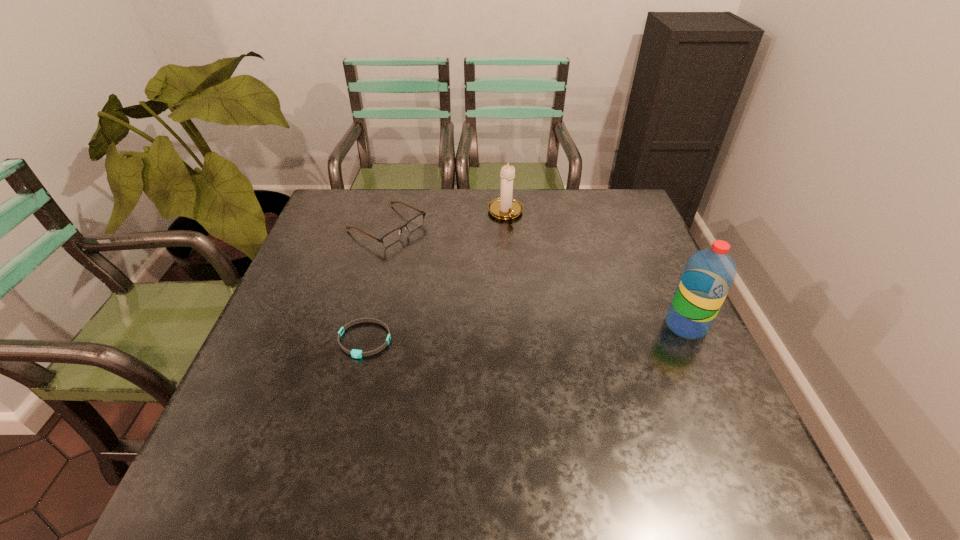
This screenshot has height=540, width=960. I want to click on vacant spot on the desktop that is between the shortest object and the tallest object and is positioned on the front-facing side of the spectacles, so click(575, 330).

Locate an element on the screen. The width and height of the screenshot is (960, 540). free space on the desktop that is between the wristband and the tallest object and is positioned on the handle side of the third object from left to right is located at coordinates (566, 330).